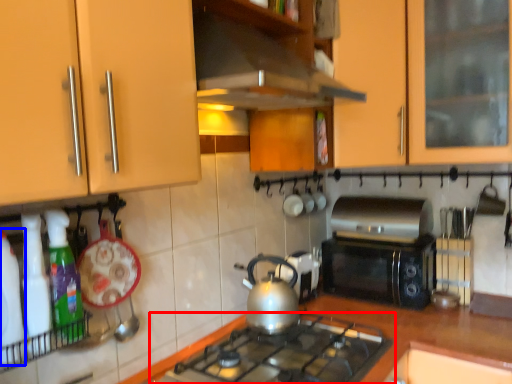
Question: Among these objects, which one is nearest to the camera, gas stove (highlighted by a red box) or bottle (highlighted by a blue box)?

Choices:
 (A) gas stove
 (B) bottle

Answer: (B)